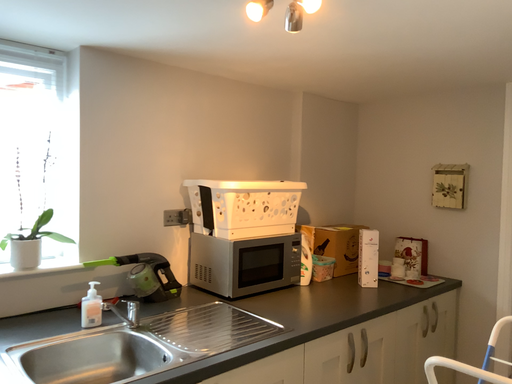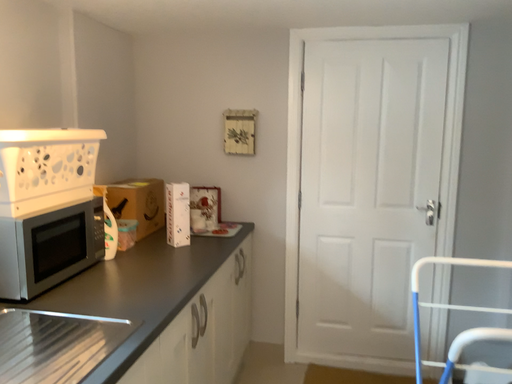
Question: Which way did the camera rotate in the video?

Choices:
 (A) rotated downward
 (B) rotated upward

Answer: (A)